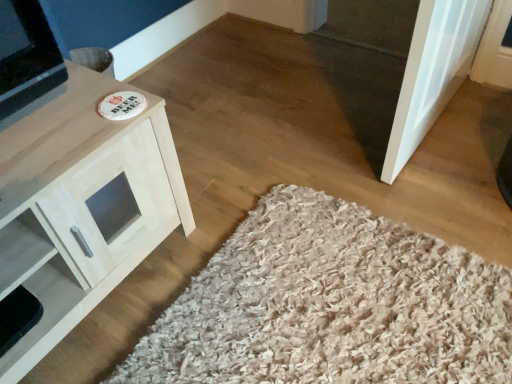
The width and height of the screenshot is (512, 384). Find the location of `vacant area located to the right-hand side of light wood cabinet at left`. vacant area located to the right-hand side of light wood cabinet at left is located at coordinates (211, 229).